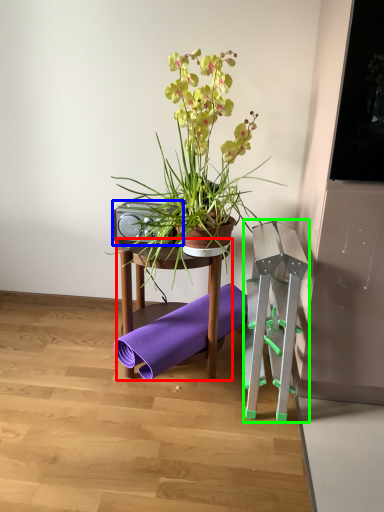
Question: Which is farther away from table (highlighted by a red box)? speaker (highlighted by a blue box) or step stool (highlighted by a green box)?

Choices:
 (A) speaker
 (B) step stool

Answer: (B)